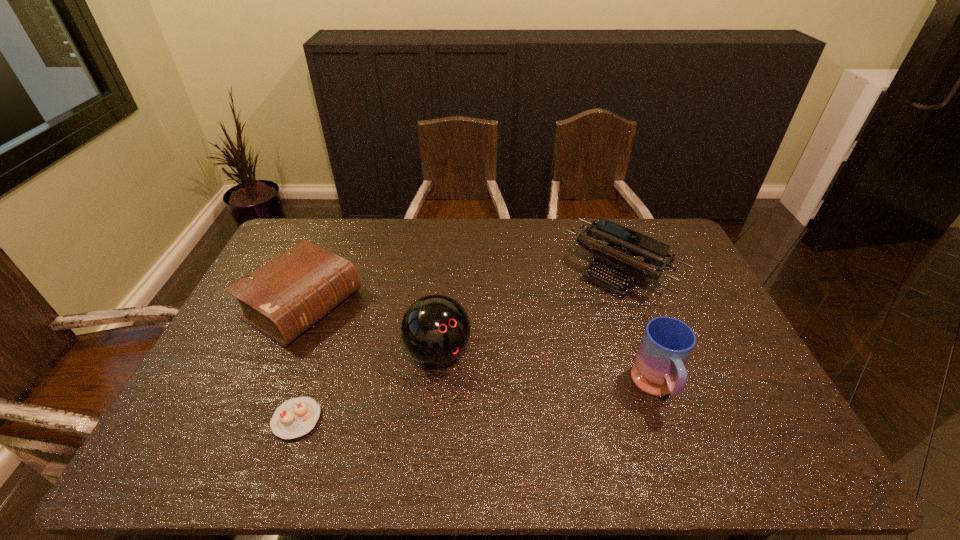
Identify the location of cupcake. This screenshot has height=540, width=960. (296, 417).

At what (x,y) coordinates should I click in order to perform the action: click on mug. Please return your answer as a coordinate pair (x, y). This screenshot has width=960, height=540. Looking at the image, I should click on (667, 343).

Identify the location of Bible. (282, 299).

Locate an element on the screen. typewriter is located at coordinates (614, 252).

You are a GUI agent. You are given a task and a screenshot of the screen. Output one action in this format:
    pyautogui.click(x=<x>, y=<y>)
    Task: Click on the third object from left to right
    This screenshot has height=540, width=960.
    Given the screenshot: What is the action you would take?
    pyautogui.click(x=435, y=329)

The width and height of the screenshot is (960, 540). What are the coordinates of `vacant space located on the back of the shortest object` in the screenshot? It's located at [x=314, y=370].

Identify the location of vacant area located 0.310m on the spine side of the Bible. (423, 378).

Identify the location of vacant space located on the spine side of the Bible. (357, 338).

Locate an element on the screen. Image resolution: width=960 pixels, height=540 pixels. free space located on the spine side of the Bible is located at coordinates (423, 378).

Image resolution: width=960 pixels, height=540 pixels. What are the coordinates of `vacant area situated on the typing side of the typewriter` in the screenshot? It's located at (575, 311).